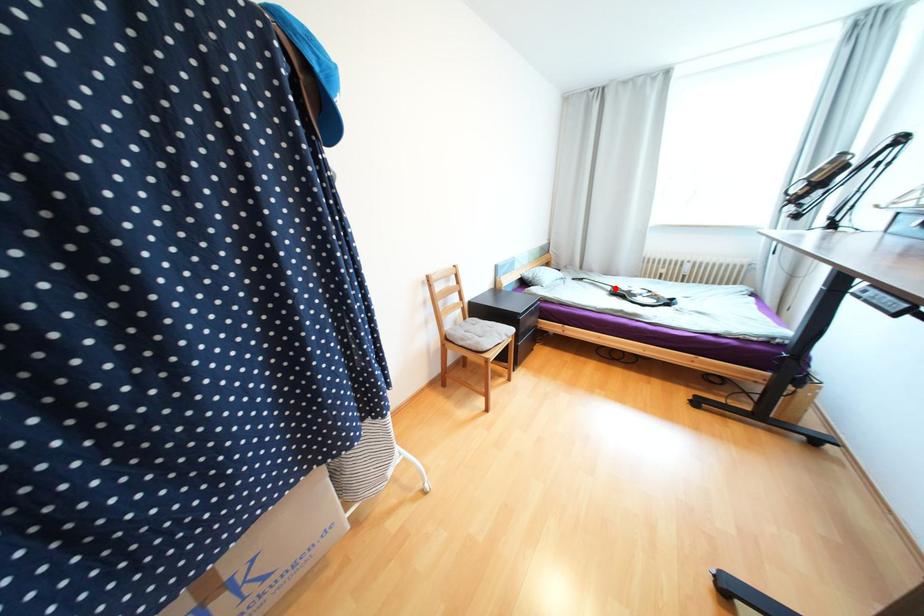
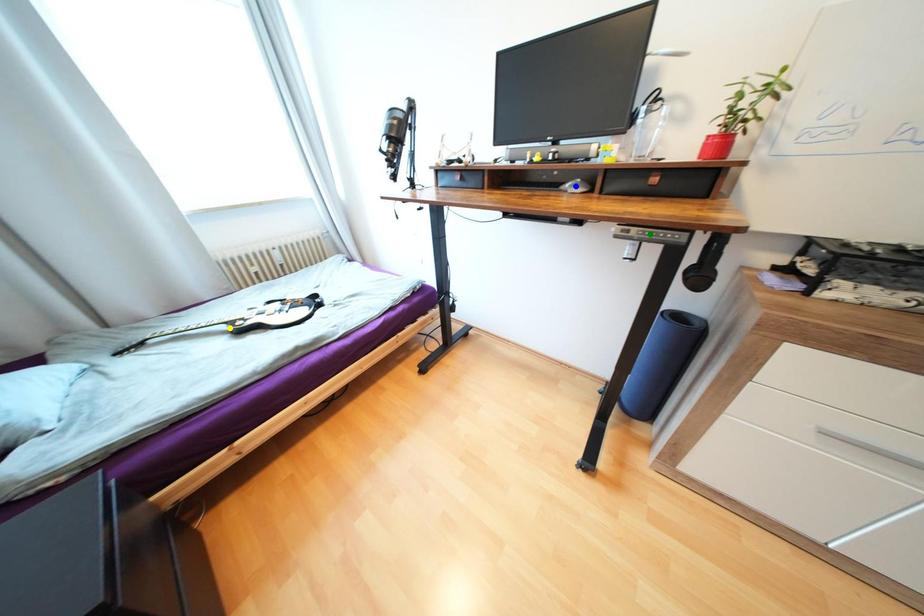
Question: I am providing you with two images of the same scene from different viewpoints. A red point is marked on the first image. You are given multiple points on the second image. Can you choose the point in image 2 that corresponds to the point in image 1?

Choices:
 (A) blue point
 (B) green point
 (C) yellow point

Answer: (C)